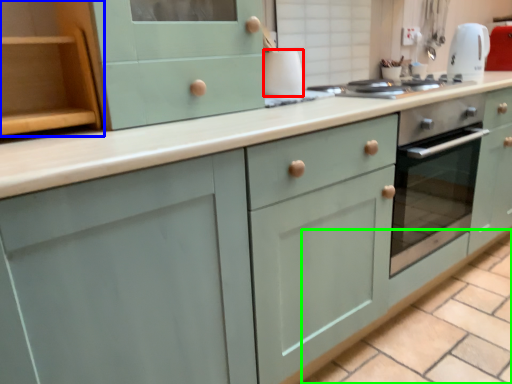
Question: Considering the real-world distances, which object is closest to appliance (highlighted by a red box)? cabinetry (highlighted by a blue box) or tile (highlighted by a green box).

Choices:
 (A) cabinetry
 (B) tile

Answer: (A)